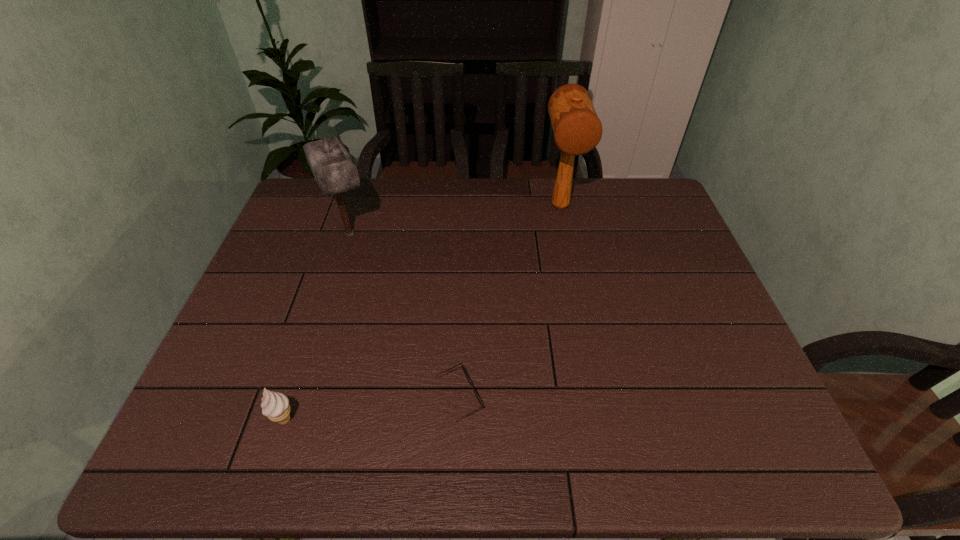
Locate an element on the screen. vacant area that lies between the third object from left to right and the second shortest object is located at coordinates (372, 408).

Where is `vacant area that lies between the right mallet and the second shortest object`? This screenshot has height=540, width=960. vacant area that lies between the right mallet and the second shortest object is located at coordinates click(422, 313).

At what (x,y) coordinates should I click in order to perform the action: click on vacant space that is in between the rightmost object and the shortest object. Please return your answer as a coordinate pair (x, y). This screenshot has height=540, width=960. Looking at the image, I should click on (510, 302).

This screenshot has height=540, width=960. I want to click on free space between the left mallet and the third object from left to right, so click(x=404, y=315).

Where is `unoccupied area between the shortest object and the icecream`? The width and height of the screenshot is (960, 540). unoccupied area between the shortest object and the icecream is located at coordinates (372, 408).

The width and height of the screenshot is (960, 540). What are the coordinates of `empty location between the left mallet and the right mallet` in the screenshot? It's located at (x=455, y=220).

I want to click on vacant space that's between the icecream and the right mallet, so click(x=422, y=313).

Where is `unoccupied position between the second shortest object and the second object from right to left`? unoccupied position between the second shortest object and the second object from right to left is located at coordinates (372, 408).

You are a GUI agent. You are given a task and a screenshot of the screen. Output one action in this format:
    pyautogui.click(x=<x>, y=<y>)
    Task: Click on the unoccupied position between the right mallet and the second shortest object
    
    Given the screenshot: What is the action you would take?
    pyautogui.click(x=422, y=313)

I want to click on empty location between the third tallest object and the second object from right to left, so click(x=372, y=408).